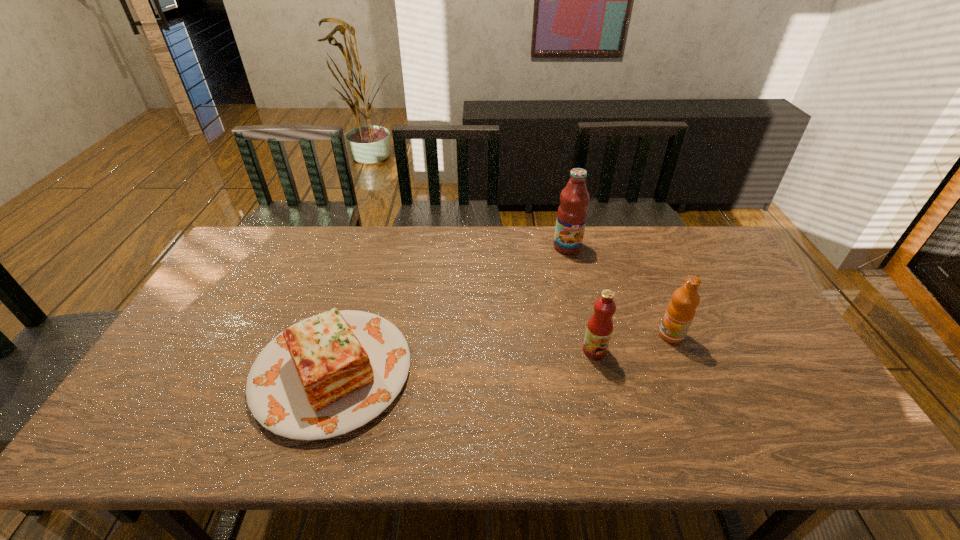
Locate an element on the screen. the farthest fruit juice is located at coordinates (572, 213).

Find the location of a particular element. the farthest object is located at coordinates (572, 213).

I want to click on the rightmost object, so click(681, 310).

Locate an element on the screen. This screenshot has height=540, width=960. the shortest object is located at coordinates (327, 375).

The height and width of the screenshot is (540, 960). What are the coordinates of `lasagna` in the screenshot? It's located at (327, 375).

Identify the location of free location located 0.120m on the front label of the farthest fruit juice. (575, 278).

The width and height of the screenshot is (960, 540). In order to click on blank area located 0.380m on the label side of the rightmost fruit juice in this screenshot , I will do `click(523, 335)`.

The image size is (960, 540). In order to click on vacant space located 0.400m on the label side of the rightmost fruit juice in this screenshot , I will do `click(516, 335)`.

Identify the location of vacant space situated on the label side of the rightmost fruit juice. The width and height of the screenshot is (960, 540). (594, 335).

The image size is (960, 540). Find the location of `vacant area located on the right of the shortest object`. vacant area located on the right of the shortest object is located at coordinates (526, 372).